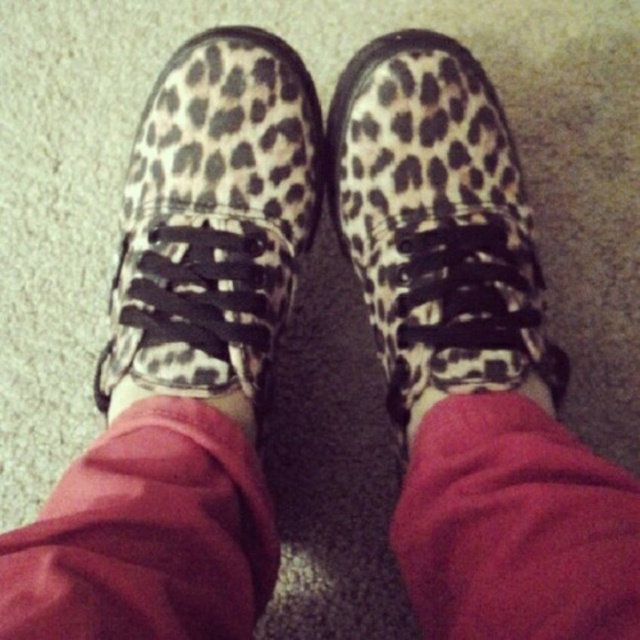
Question: Among these points, which one is farthest from the camera?

Choices:
 (A) (244, 540)
 (B) (378, 189)
 (C) (211, 296)

Answer: (B)

Question: Can you confirm if leopard print sneaker at center is positioned below leopard print shoe at center?

Choices:
 (A) no
 (B) yes

Answer: (A)

Question: Based on their relative distances, which object is nearer to the leopard print shoe at center?

Choices:
 (A) pink fabric sock at center
 (B) leopard print sneaker at center

Answer: (B)

Question: Where is leopard print sneaker at center located in relation to pink fabric sock at center in the image?

Choices:
 (A) left
 (B) right

Answer: (A)

Question: Based on their relative distances, which object is farther from the pink fabric sock at center?

Choices:
 (A) leopard print sneaker at center
 (B) leopard print shoe at center

Answer: (B)

Question: Is leopard print sneaker at center further to camera compared to leopard print shoe at center?

Choices:
 (A) no
 (B) yes

Answer: (A)